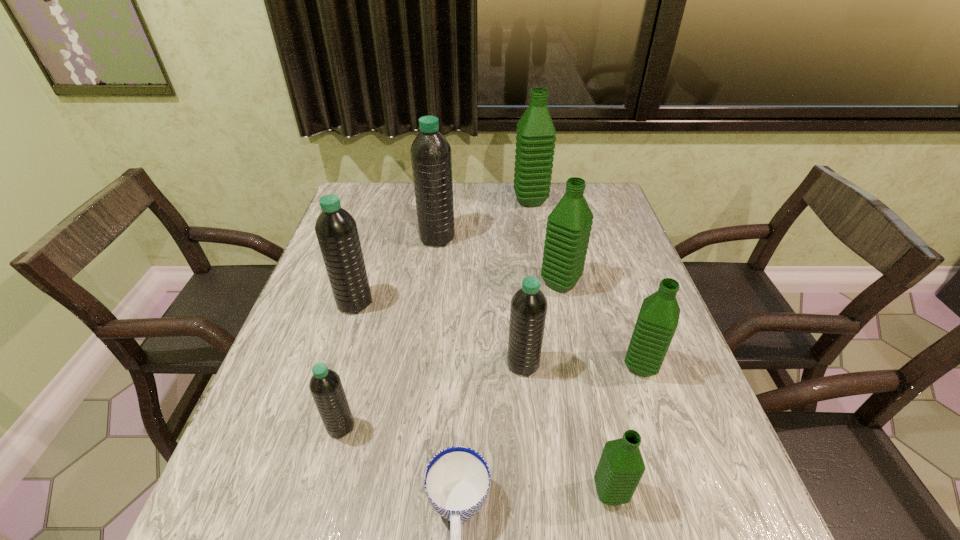
Locate an element on the screen. the eighth nearest object is located at coordinates (431, 159).

This screenshot has height=540, width=960. What are the coordinates of `the biggest black water bottle` in the screenshot? It's located at (431, 159).

In order to click on the farthest green water bottle in this screenshot , I will do `click(535, 138)`.

Identify the location of the biggest green water bottle. (535, 138).

Find the location of a particular element. This screenshot has height=540, width=960. the second biggest green water bottle is located at coordinates (568, 229).

The width and height of the screenshot is (960, 540). I want to click on the third smallest black water bottle, so click(336, 230).

Where is `the third farthest black water bottle`? This screenshot has height=540, width=960. the third farthest black water bottle is located at coordinates pyautogui.click(x=528, y=309).

Locate an element on the screen. The image size is (960, 540). the second smallest black water bottle is located at coordinates (528, 309).

Locate an element on the screen. This screenshot has height=540, width=960. the second smallest green water bottle is located at coordinates (657, 321).

Where is `the rightmost green water bottle`? the rightmost green water bottle is located at coordinates (657, 321).